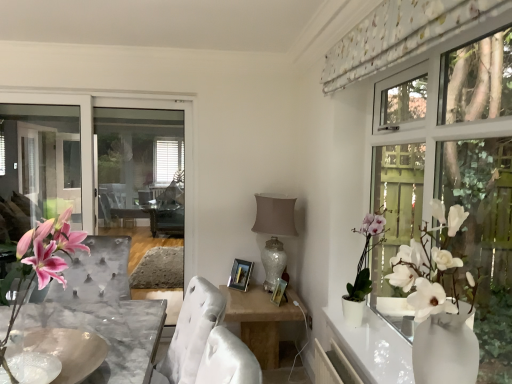
Question: Relative to white glossy lamp at center, is white floral fabric at upper right in front or behind?

Choices:
 (A) behind
 (B) front

Answer: (B)

Question: Based on their sizes in the image, would you say white floral fabric at upper right is bigger or smaller than white glossy lamp at center?

Choices:
 (A) small
 (B) big

Answer: (A)

Question: Estimate the real-world distances between objects in this image. Which object is farther from the white glossy lamp at center?

Choices:
 (A) white floral fabric at upper right
 (B) pink silk flowers at lower left
 (C) clear glass window screen at left
 (D) satin beige table at center
 (E) white ceramic plant at upper right

Answer: (B)

Question: Estimate the real-world distances between objects in this image. Which object is closer to the clear glass window screen at left?

Choices:
 (A) pink silk flowers at lower left
 (B) white floral fabric at upper right
 (C) white ceramic plant at upper right
 (D) marble bowl at center
 (E) white glossy lamp at center

Answer: (E)